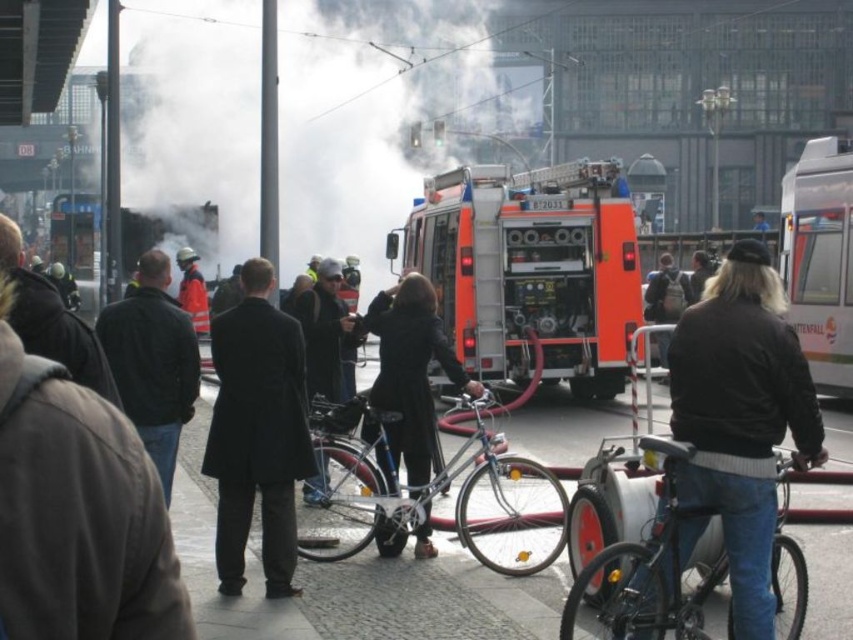
Is black smoke at left thinner than black matte coat at center?

No, black smoke at left is not thinner than black matte coat at center.

Is point (498, 4) less distant than point (402, 337)?

No.

Locate an element on the screen. The width and height of the screenshot is (853, 640). black smoke at left is located at coordinates (370, 113).

Between black matte coat at center and dark gray coat at left, which one has less height?

dark gray coat at left is shorter.

Who is more forward, (x=387, y=400) or (x=86, y=368)?

Point (x=86, y=368) is more forward.

The width and height of the screenshot is (853, 640). Find the location of `black matte coat at center`. black matte coat at center is located at coordinates (409, 374).

Between orange matte fire truck at center and dark gray coat at left, which one appears on the left side from the viewer's perspective?

Positioned to the left is dark gray coat at left.

Describe the element at coordinates (531, 269) in the screenshot. The height and width of the screenshot is (640, 853). I see `orange matte fire truck at center` at that location.

Identify the location of orange matte fire truck at center. (531, 269).

Locate an element on the screen. orange matte fire truck at center is located at coordinates (531, 269).